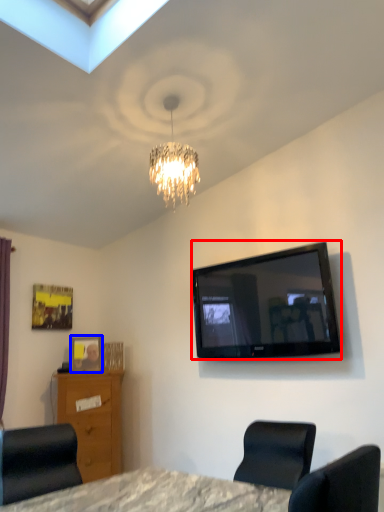
Question: Among these objects, which one is nearest to the camera, television (highlighted by a red box) or picture frame (highlighted by a blue box)?

Choices:
 (A) television
 (B) picture frame

Answer: (A)